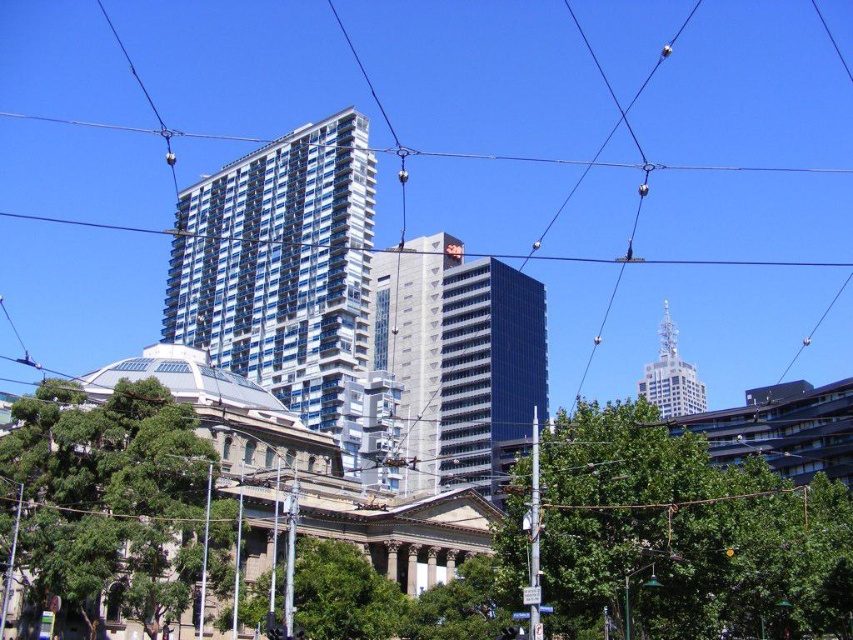
Question: Does glassy blue building at center have a lesser width compared to transparent glass power line at upper center?

Choices:
 (A) yes
 (B) no

Answer: (A)

Question: Among these points, which one is farthest from the camera?

Choices:
 (A) (663, 416)
 (B) (206, 241)

Answer: (A)

Question: Can you confirm if green leafy tree at lower center is smaller than glassy blue building at center?

Choices:
 (A) yes
 (B) no

Answer: (A)

Question: Can you confirm if green leafy tree at lower center is thinner than white glass tower at upper right?

Choices:
 (A) no
 (B) yes

Answer: (B)

Question: Which of the following is the closest to the observer?

Choices:
 (A) glassy blue building at center
 (B) smooth glass building at center
 (C) white glass tower at upper right

Answer: (C)

Question: Which point is farther to the camera?

Choices:
 (A) (653, 394)
 (B) (134, 230)
 (C) (271, 268)
 (D) (556, 560)

Answer: (A)